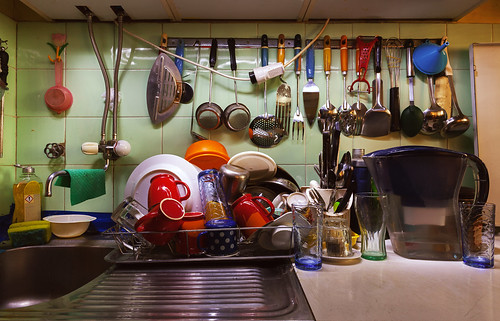
This screenshot has height=321, width=500. What are the coordinates of `cups with handles` in the screenshot? It's located at (295, 198), (258, 208), (224, 245), (188, 222), (157, 226), (159, 188).